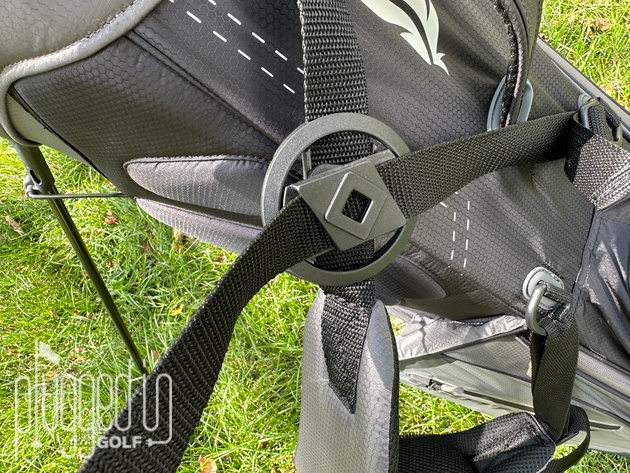
Image resolution: width=630 pixels, height=473 pixels. Find the location of `padding`. padding is located at coordinates tap(209, 175), tap(209, 228).